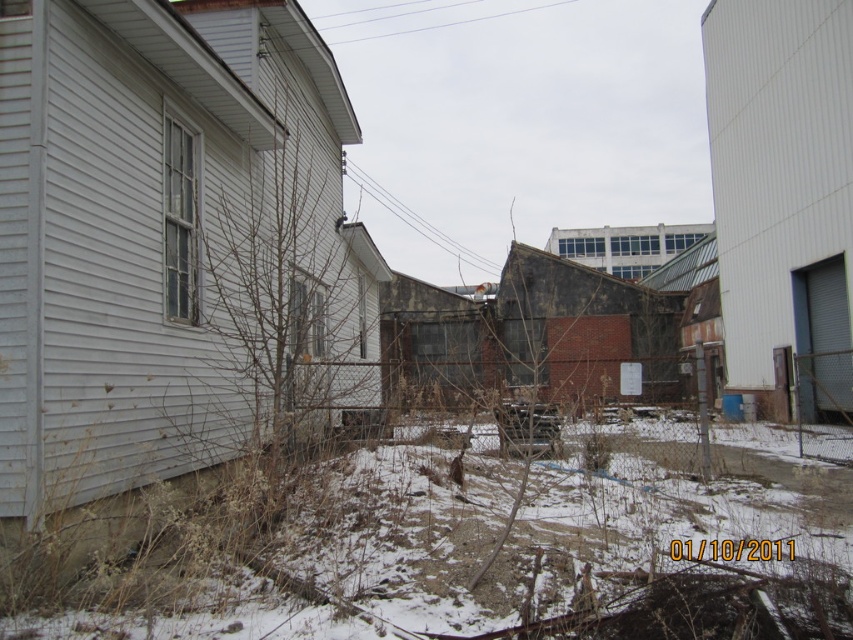
Question: Does metallic wire at upper center appear under white wire at upper center?

Choices:
 (A) yes
 (B) no

Answer: (A)

Question: Which of the following is the farthest from the observer?

Choices:
 (A) (509, 13)
 (B) (390, 202)

Answer: (A)

Question: Where is metallic wire at upper center located in relation to white wire at upper center in the image?

Choices:
 (A) left
 (B) right

Answer: (A)

Question: From the image, what is the correct spatial relationship of metallic wire at upper center in relation to white wire at upper center?

Choices:
 (A) left
 (B) right

Answer: (A)